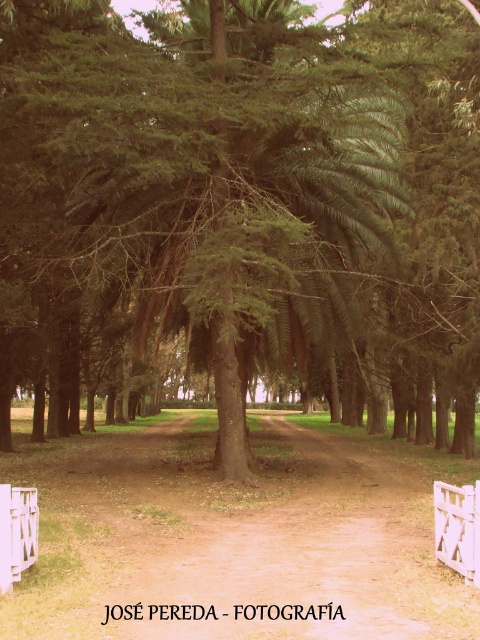
Question: Is white wooden fence at lower right to the left of white wooden fence at lower left from the viewer's perspective?

Choices:
 (A) yes
 (B) no

Answer: (B)

Question: Can you confirm if white wooden fence at lower right is positioned to the right of white wooden fence at lower left?

Choices:
 (A) no
 (B) yes

Answer: (B)

Question: Is white wooden fence at lower right wider than white wooden fence at lower left?

Choices:
 (A) no
 (B) yes

Answer: (B)

Question: Which point is farther to the camera?

Choices:
 (A) white wooden fence at lower left
 (B) white wooden fence at lower right

Answer: (B)